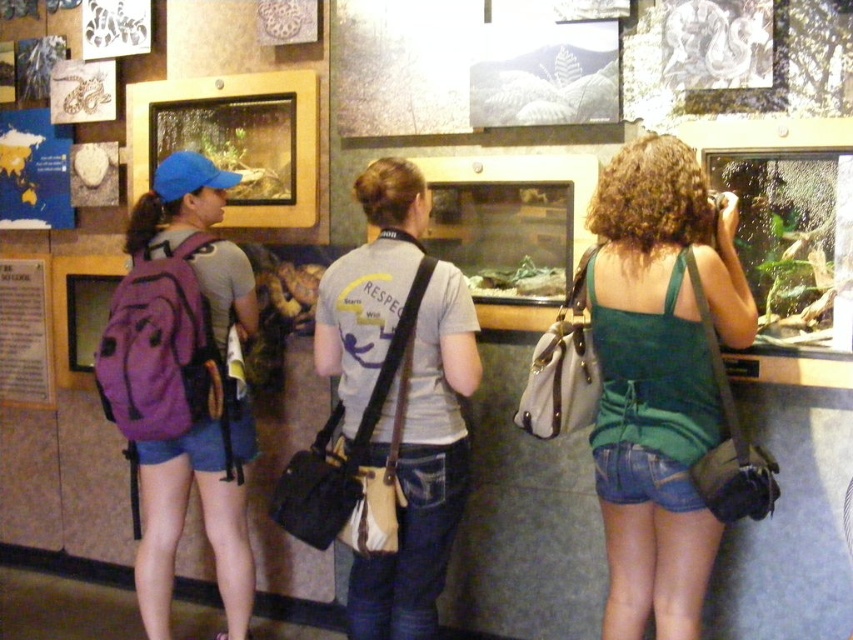
Based on the photo, you are a security guard in the reptile museum. You need to ensure that the green fabric tank top at center and the purple fabric backpack at left are not blocking the emergency exit sign. According to the layout, which item is closer to the exit sign?

The green fabric tank top at center is positioned over the purple fabric backpack at left, meaning it is closer to the exit sign.

What is the exact location of the green fabric tank top at center in the image?

The green fabric tank top at center is located at point (659, 378).